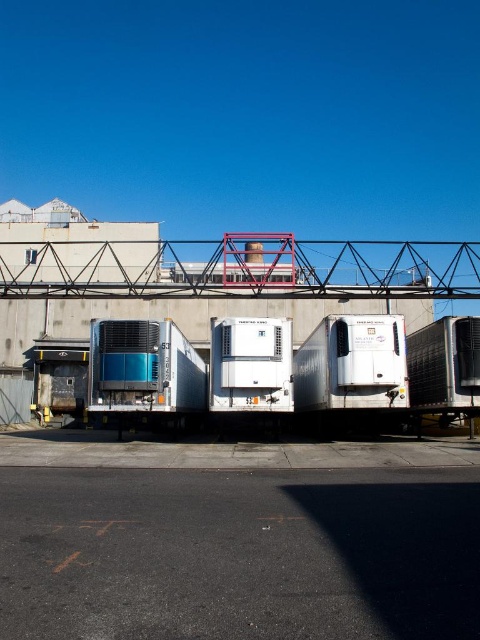
Is metallic red bridge at upper center bigger than metallic blue trailer truck at center?

Yes.

Locate an element on the screen. Image resolution: width=480 pixels, height=640 pixels. metallic red bridge at upper center is located at coordinates (242, 266).